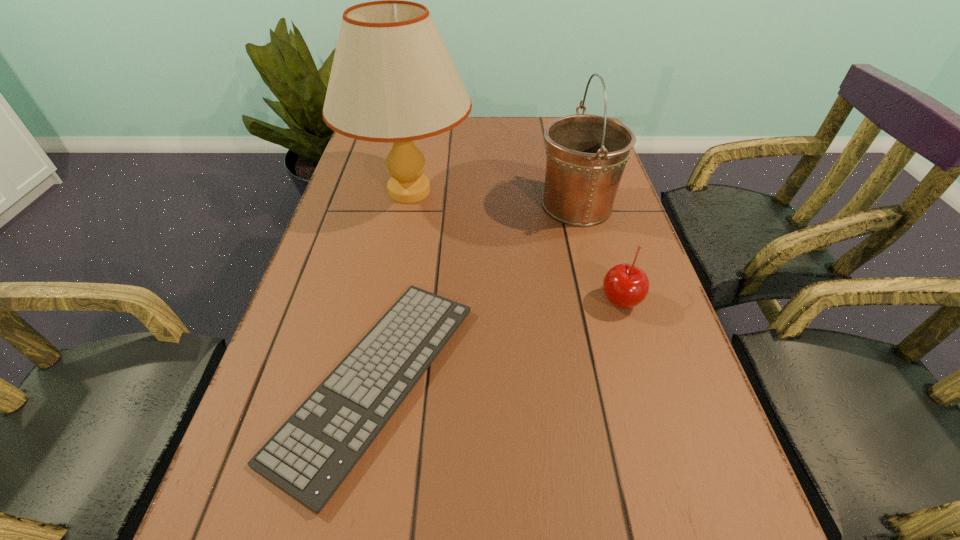
Where is `lampshade`? lampshade is located at coordinates (392, 80).

Where is `the second tallest object`? Image resolution: width=960 pixels, height=540 pixels. the second tallest object is located at coordinates (586, 154).

Where is `the second shortest object`? This screenshot has width=960, height=540. the second shortest object is located at coordinates (625, 286).

At what (x,y) coordinates should I click in order to perform the action: click on computer keyboard. Please return your answer as a coordinate pair (x, y). This screenshot has height=540, width=960. Looking at the image, I should click on (310, 455).

The image size is (960, 540). I want to click on free region located on the right of the lampshade, so click(x=499, y=192).

This screenshot has height=540, width=960. I want to click on vacant space situated on the front of the third shortest object, so click(591, 263).

Locate an element on the screen. The height and width of the screenshot is (540, 960). vacant point located on the front of the second shortest object is located at coordinates (632, 339).

I want to click on vacant space located on the back of the computer keyboard, so click(408, 208).

Find the location of `lampshade that is at the left edge`. lampshade that is at the left edge is located at coordinates coord(392,80).

Where is `computer keyboard present at the left edge`? computer keyboard present at the left edge is located at coordinates tap(310, 455).